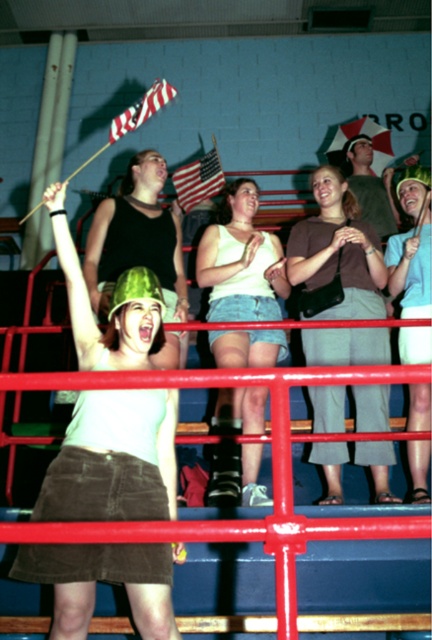
Is matte green helmet at center further to camera compared to matte green helmet at upper right?

No, it is not.

The height and width of the screenshot is (640, 432). What do you see at coordinates (114, 461) in the screenshot?
I see `matte green helmet at center` at bounding box center [114, 461].

Where is `matte green helmet at center`? This screenshot has height=640, width=432. matte green helmet at center is located at coordinates (114, 461).

Is matte green helmet at center wider than brown fabric pants at center?

Indeed, matte green helmet at center has a greater width compared to brown fabric pants at center.

Which is behind, point (162, 502) or point (368, 257)?

Positioned behind is point (368, 257).

Which is behind, point (114, 365) or point (327, 256)?

Point (327, 256)

Find the location of a particular element. The width and height of the screenshot is (432, 640). matte green helmet at center is located at coordinates (114, 461).

Does matte green helmet at upper right appear over american flag at upper center?

No.

Can you confirm if matte green helmet at upper right is positioned to the right of american flag at upper center?

Yes, matte green helmet at upper right is to the right of american flag at upper center.

Is point (400, 259) in front of point (196, 172)?

Yes, it is in front of point (196, 172).

Locate an element on the screen. The image size is (432, 640). matte green helmet at upper right is located at coordinates (412, 244).